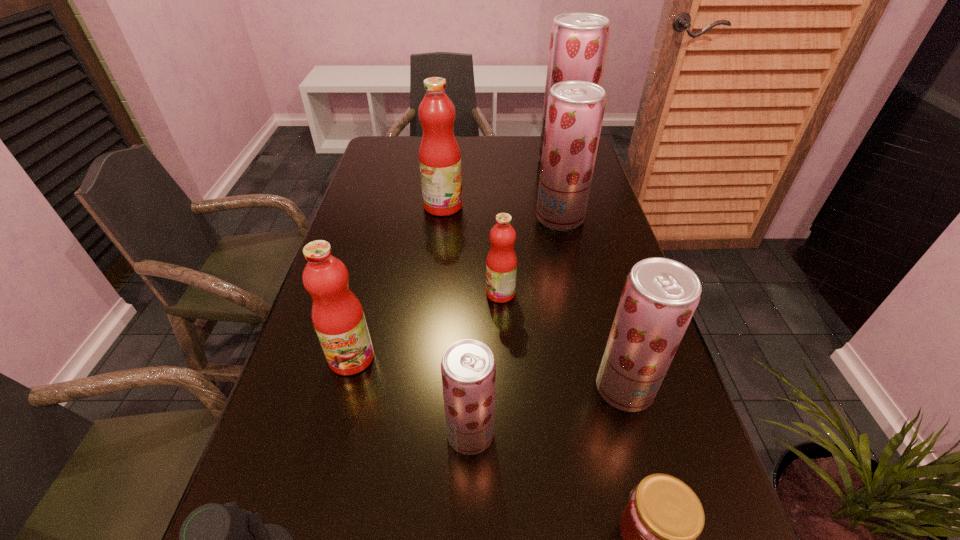
Find the location of a particular element. Image resolution: width=960 pixels, height=540 pixels. the smallest strawberry fruit juice is located at coordinates (468, 368).

At what (x,y) coordinates should I click in order to perform the action: click on free location located on the front of the farthest object. Please return your answer as a coordinate pair (x, y). This screenshot has height=540, width=960. Looking at the image, I should click on (568, 181).

At what (x,y) coordinates should I click in order to perform the action: click on vacant region located on the front label of the second pink fruit juice from left to right. Please return your answer as a coordinate pair (x, y). Looking at the image, I should click on (498, 206).

You are a GUI agent. You are given a task and a screenshot of the screen. Output one action in this format:
    pyautogui.click(x=<x>, y=<y>)
    Task: Click on the vacant position located on the front of the second farthest strawberry fruit juice
    
    Given the screenshot: What is the action you would take?
    pyautogui.click(x=581, y=310)

Where is `free region located 0.180m on the front label of the leftmost fruit juice`? free region located 0.180m on the front label of the leftmost fruit juice is located at coordinates (324, 464).

You are a GUI agent. You are given a task and a screenshot of the screen. Output one action in this format:
    pyautogui.click(x=<x>, y=<y>)
    Task: Click on the free space located on the back of the second smallest strawberry fruit juice
    The width and height of the screenshot is (960, 540).
    Given the screenshot: What is the action you would take?
    pyautogui.click(x=609, y=332)

I want to click on vacant space located 0.100m on the front label of the rightmost pink fruit juice, so click(x=444, y=293).

This screenshot has height=540, width=960. In order to click on vacant space situated on the front label of the rightmost pink fruit juice in this screenshot , I will do `click(383, 293)`.

At what (x,y) coordinates should I click in order to perform the action: click on vacant space located 0.180m on the front label of the rightmost pink fruit juice. Please return your answer as a coordinate pair (x, y). This screenshot has height=540, width=960. Looking at the image, I should click on (412, 293).

You are a GUI agent. You are given a task and a screenshot of the screen. Output one action in this format:
    pyautogui.click(x=<x>, y=<y>)
    Task: Click on the vacant area situated on the left of the smallest strawberry fruit juice
    The image size is (960, 540).
    Given the screenshot: What is the action you would take?
    pyautogui.click(x=322, y=434)